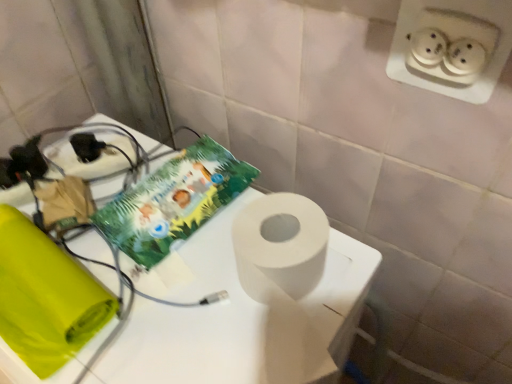
Question: Is green paper comic book at upper center to the left or to the right of white matte table at center in the image?

Choices:
 (A) right
 (B) left

Answer: (A)

Question: Considering the positions of green paper comic book at upper center and white matte table at center in the image, is green paper comic book at upper center wider or thinner than white matte table at center?

Choices:
 (A) wide
 (B) thin

Answer: (B)

Question: From the image's perspective, is green paper comic book at upper center located above or below white matte table at center?

Choices:
 (A) above
 (B) below

Answer: (A)

Question: Is point (138, 304) closer or farther from the camera than point (241, 192)?

Choices:
 (A) farther
 (B) closer

Answer: (B)

Question: From the image's perspective, is white matte table at center located above or below green paper comic book at upper center?

Choices:
 (A) above
 (B) below

Answer: (B)

Question: Would you say white matte table at center is to the left or to the right of green paper comic book at upper center in the picture?

Choices:
 (A) left
 (B) right

Answer: (A)

Question: Considering the positions of white matte table at center and green paper comic book at upper center in the image, is white matte table at center bigger or smaller than green paper comic book at upper center?

Choices:
 (A) big
 (B) small

Answer: (A)